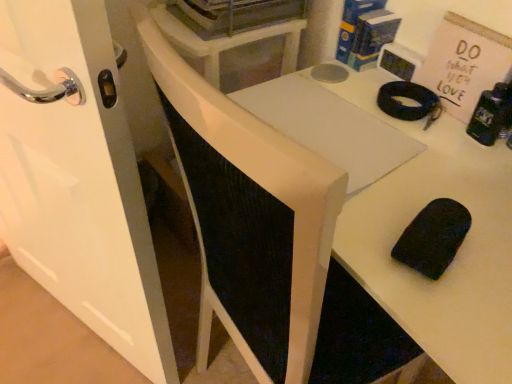
Question: Does matte black clock at upper right, the first appliance from the right, have a larger size compared to white glossy door at left?

Choices:
 (A) no
 (B) yes

Answer: (A)

Question: From a real-world perspective, does matte black clock at upper right, the first appliance from the right, sit lower than white glossy door at left?

Choices:
 (A) no
 (B) yes

Answer: (A)

Question: Is matte black clock at upper right, the first appliance from the right, not inside white glossy door at left?

Choices:
 (A) no
 (B) yes

Answer: (B)

Question: Considering the relative sizes of matte black clock at upper right, which is the 2th appliance from left to right, and white glossy door at left in the image provided, is matte black clock at upper right, which is the 2th appliance from left to right, thinner than white glossy door at left?

Choices:
 (A) no
 (B) yes

Answer: (B)

Question: Is matte black clock at upper right, the 1th appliance from the bottom, positioned far away from white glossy door at left?

Choices:
 (A) no
 (B) yes

Answer: (A)

Question: From the image's perspective, is matte black clock at upper right, the 1th appliance from the bottom, located beneath white glossy door at left?

Choices:
 (A) no
 (B) yes

Answer: (A)

Question: Is metallic gray dishwasher at upper center, positioned as the first appliance in top-to-bottom order, next to white glossy door at left?

Choices:
 (A) yes
 (B) no

Answer: (B)

Question: Is metallic gray dishwasher at upper center, the 2th appliance in the bottom-to-top sequence, in front of white glossy door at left?

Choices:
 (A) yes
 (B) no

Answer: (B)

Question: Considering the relative sizes of metallic gray dishwasher at upper center, positioned as the first appliance in top-to-bottom order, and white glossy door at left in the image provided, is metallic gray dishwasher at upper center, positioned as the first appliance in top-to-bottom order, shorter than white glossy door at left?

Choices:
 (A) no
 (B) yes

Answer: (B)

Question: Is metallic gray dishwasher at upper center, the 2th appliance in the bottom-to-top sequence, oriented away from white glossy door at left?

Choices:
 (A) yes
 (B) no

Answer: (B)

Question: Is white glossy door at left a part of metallic gray dishwasher at upper center, which is the second appliance from right to left?

Choices:
 (A) no
 (B) yes

Answer: (A)

Question: Does metallic gray dishwasher at upper center, the first appliance in the left-to-right sequence, have a greater height compared to white glossy door at left?

Choices:
 (A) yes
 (B) no

Answer: (B)

Question: From the image's perspective, does metallic gray dishwasher at upper center, which is the second appliance from right to left, appear higher than matte black clock at upper right, the 1th appliance from the bottom?

Choices:
 (A) yes
 (B) no

Answer: (A)